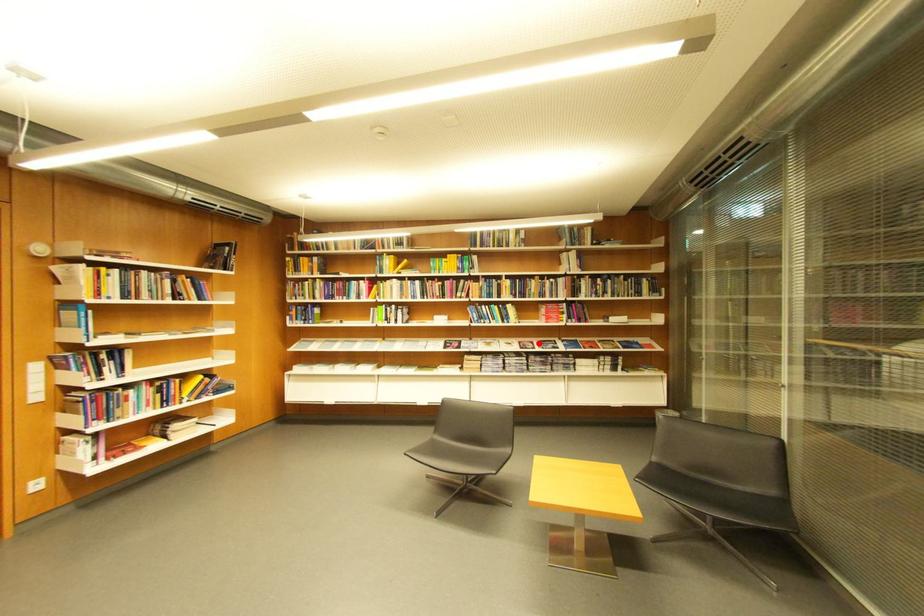
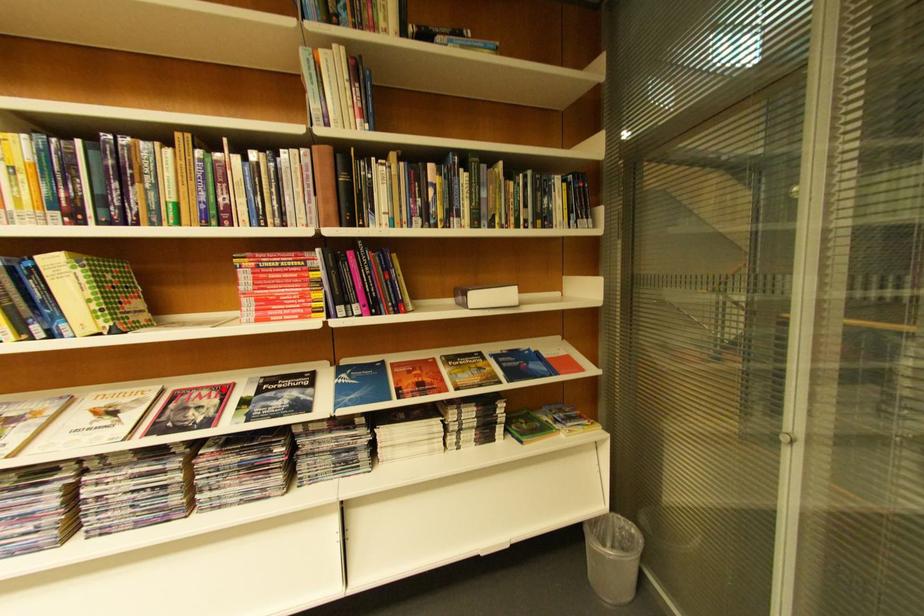
I am providing you with two images of the same scene from different viewpoints. A red point is marked on the first image and another point is marked on the second image. Is the marked point in image1 the same physical position as the marked point in image2?

Yes